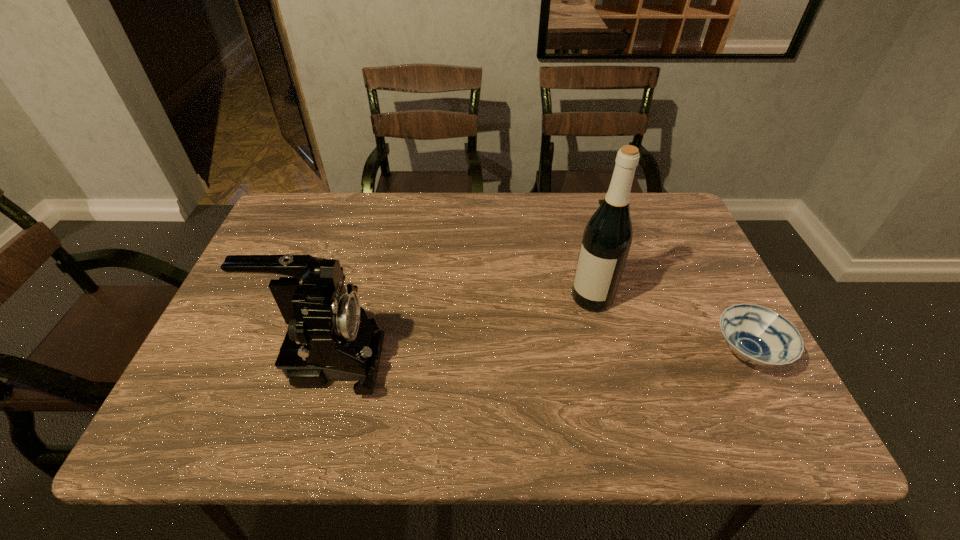
The width and height of the screenshot is (960, 540). I want to click on camcorder, so click(330, 338).

The height and width of the screenshot is (540, 960). What are the coordinates of `the leftmost object` in the screenshot? It's located at (330, 338).

The image size is (960, 540). I want to click on the rightmost object, so click(758, 335).

Identify the location of the farthest object. The width and height of the screenshot is (960, 540). (600, 200).

At what (x,y) coordinates should I click in order to perform the action: click on wine bottle. Please return your answer as a coordinate pair (x, y). Looking at the image, I should click on (607, 238).

Locate an element on the screen. The width and height of the screenshot is (960, 540). the tallest object is located at coordinates (607, 238).

Find the location of `free region located 0.280m on the lens mount of the leftmost object`. free region located 0.280m on the lens mount of the leftmost object is located at coordinates (511, 359).

Locate an element on the screen. This screenshot has width=960, height=540. free spot located on the left of the soup bowl is located at coordinates (540, 353).

The height and width of the screenshot is (540, 960). Identify the location of vacant space positioned in front of the lenses of the sunglasses. (596, 259).

I want to click on free point located in front of the lenses of the sunglasses, so click(x=591, y=294).